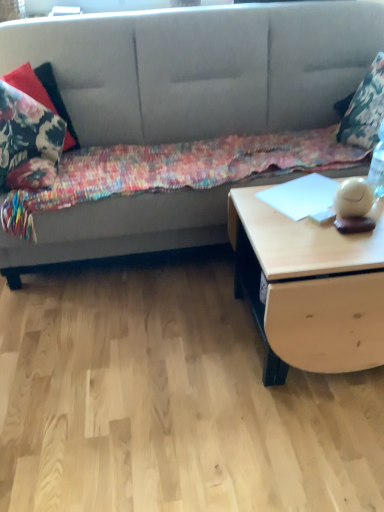
I want to click on vacant area to the left of light wood/texture table at right, so click(x=177, y=344).